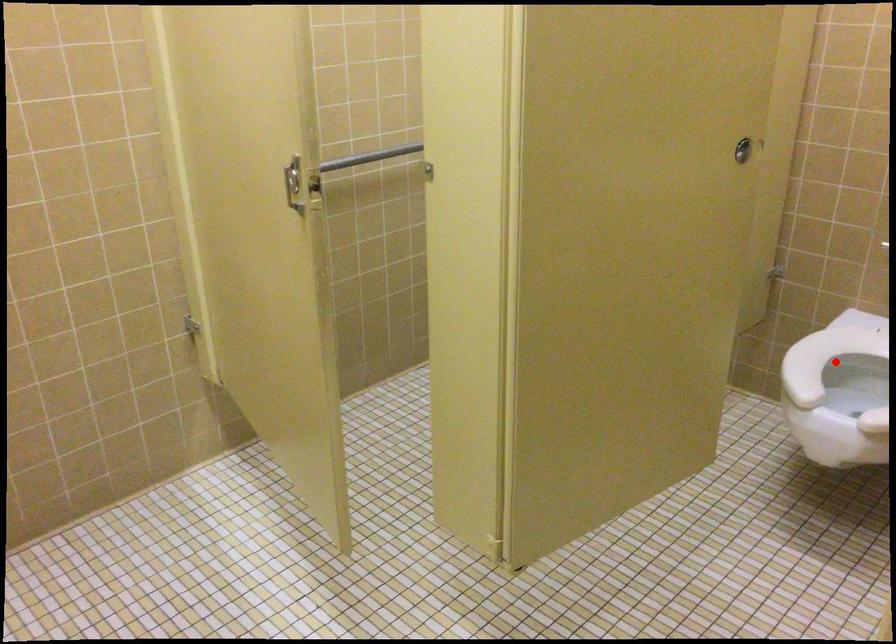
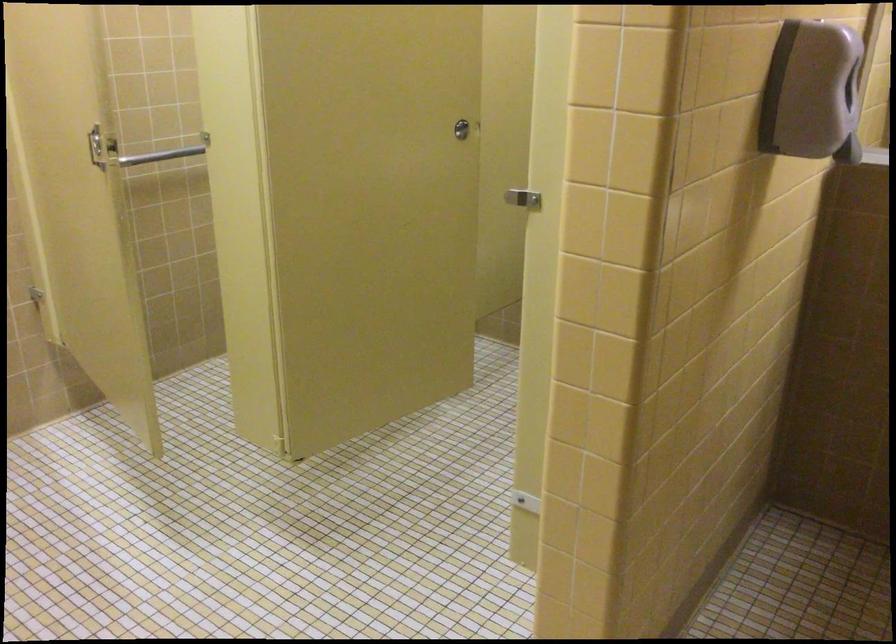
Question: I am providing you with two images of the same scene from different viewpoints. A red point is marked on the first image. Can you still see the location of the red point in image 2?

Choices:
 (A) Yes
 (B) No

Answer: (B)